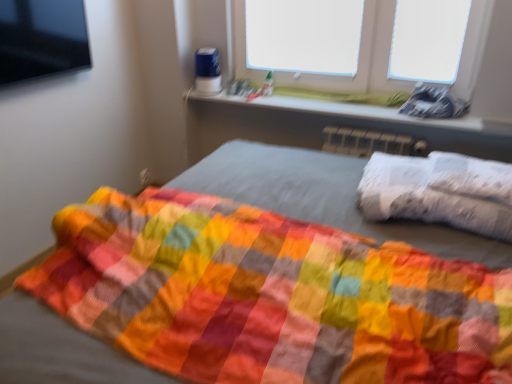
Identify the location of free space above white plastic window sill at upper center (from a real-world perspective). (339, 105).